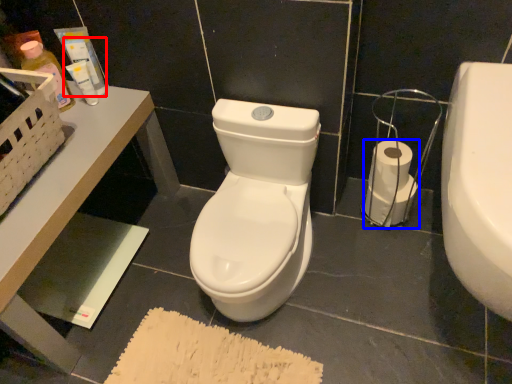
Question: Which point is closer to the camera, toiletry (highlighted by a red box) or toilet paper (highlighted by a blue box)?

Choices:
 (A) toiletry
 (B) toilet paper

Answer: (A)